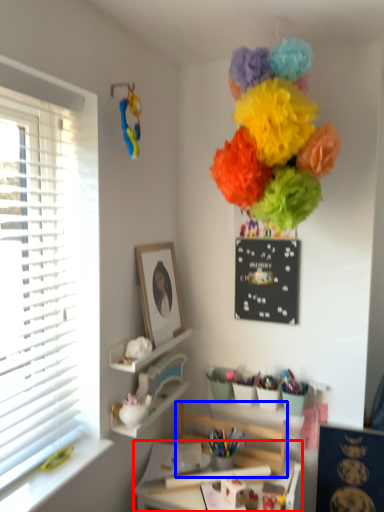
Question: Which object appears farthest to the camera in this image, table (highlighted by a red box) or swivel chair (highlighted by a blue box)?

Choices:
 (A) table
 (B) swivel chair

Answer: (B)